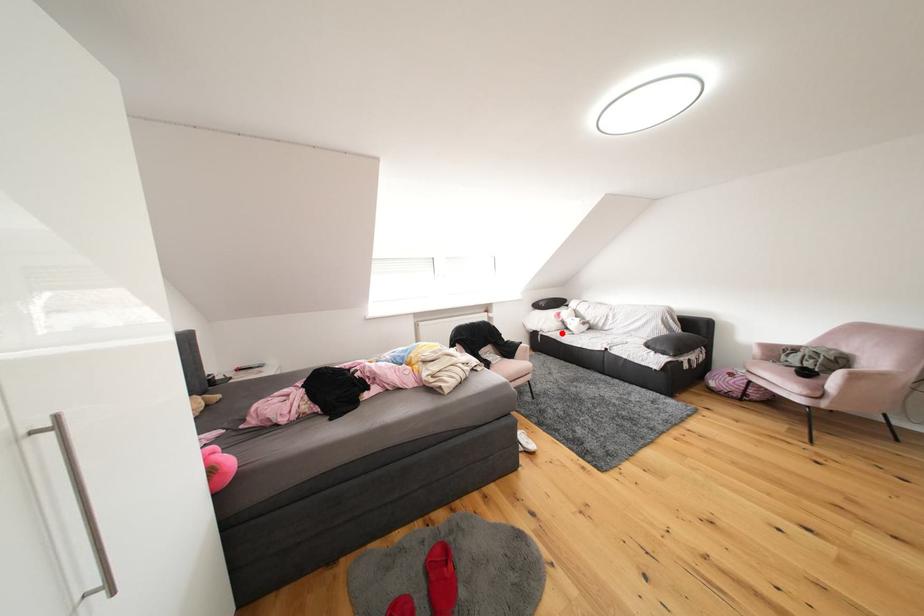
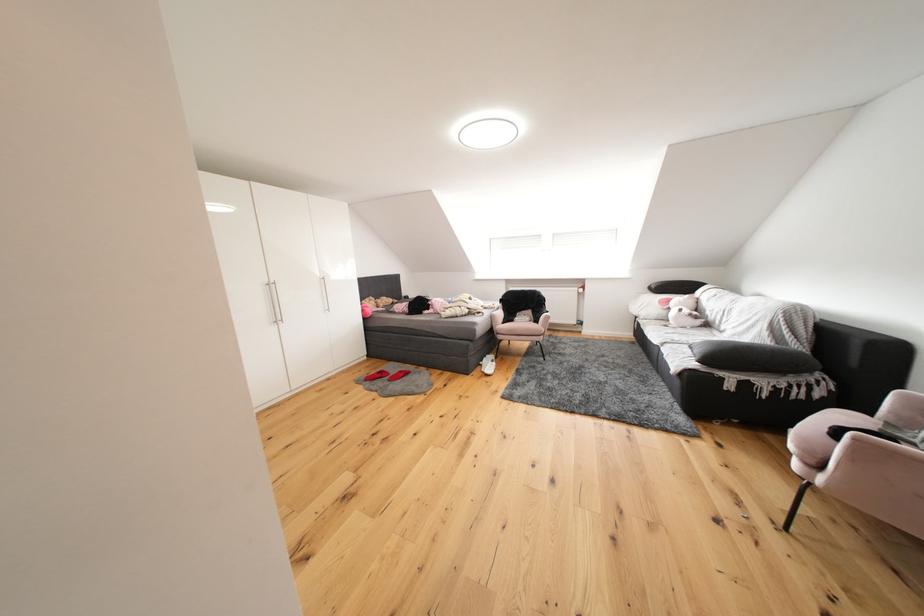
Where in the second image is the point corresponding to the highlighted location from the first image?

(660, 321)